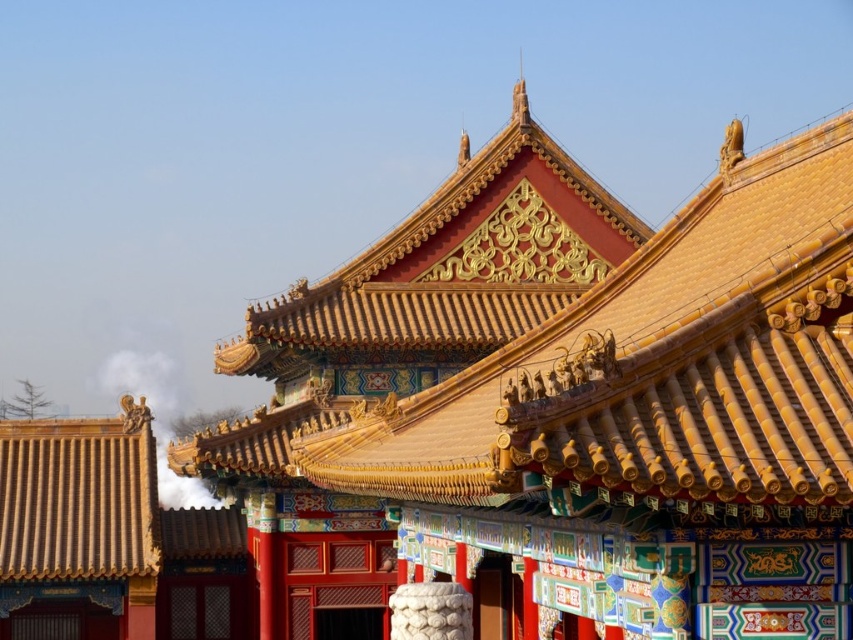
Question: Which of the following is the farthest from the observer?

Choices:
 (A) (181, 416)
 (B) (608, 544)

Answer: (A)

Question: Among these objects, which one is farthest from the camera?

Choices:
 (A) white smoke at roof top
 (B) golden glazed tiles at center

Answer: (A)

Question: Can you confirm if golden glazed tiles at center is thinner than white smoke at roof top?

Choices:
 (A) yes
 (B) no

Answer: (A)

Question: Is golden glazed tiles at center positioned in front of white smoke at roof top?

Choices:
 (A) yes
 (B) no

Answer: (A)

Question: Can you confirm if golden glazed tiles at center is positioned above white smoke at roof top?

Choices:
 (A) yes
 (B) no

Answer: (A)

Question: Among these objects, which one is nearest to the camera?

Choices:
 (A) golden glazed tiles at center
 (B) white smoke at roof top

Answer: (A)